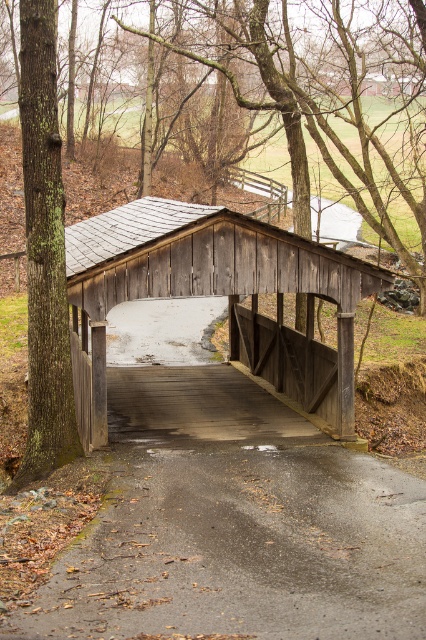
You are standing on the rustic wooden covered bridge and want to take a photo of both the smooth asphalt path at center and the green mossy bark tree at left. Which object should you focus on first if you want to capture both in a single frame without moving the camera?

You should focus on the smooth asphalt path at center first because it is closer to the viewer, allowing the green mossy bark tree at left to be in the background of the same frame.